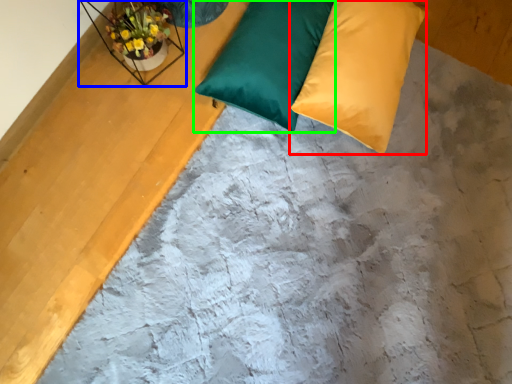
Question: Considering the real-world distances, which object is farthest from pillow (highlighted by a red box)? window sill (highlighted by a blue box) or pillow (highlighted by a green box)?

Choices:
 (A) window sill
 (B) pillow

Answer: (A)